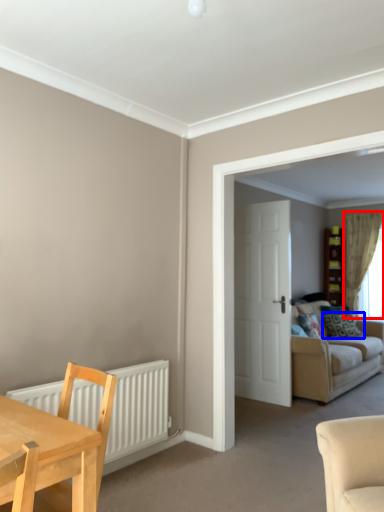
Question: Which object is closer to the camera taking this photo, curtain (highlighted by a red box) or pillow (highlighted by a blue box)?

Choices:
 (A) curtain
 (B) pillow

Answer: (B)